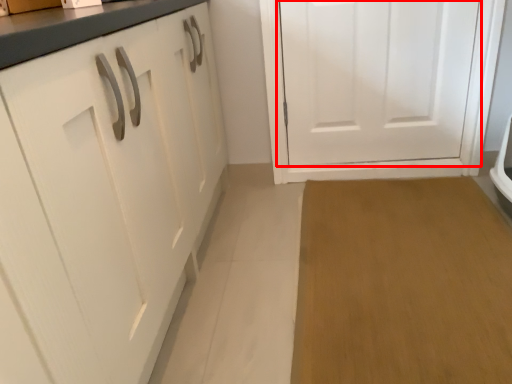
Question: In this image, where is door (annotated by the red box) located relative to plain?

Choices:
 (A) right
 (B) left

Answer: (B)